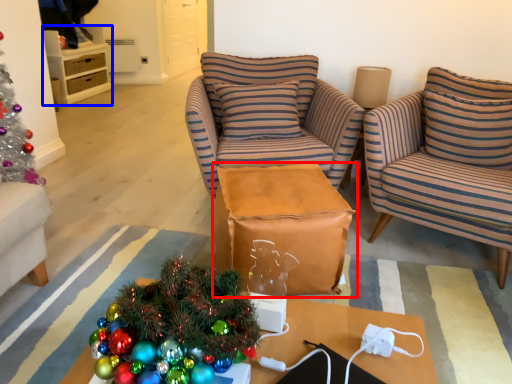
Question: Which object appears closest to the camera in this image, table (highlighted by a red box) or cabinetry (highlighted by a blue box)?

Choices:
 (A) table
 (B) cabinetry

Answer: (A)